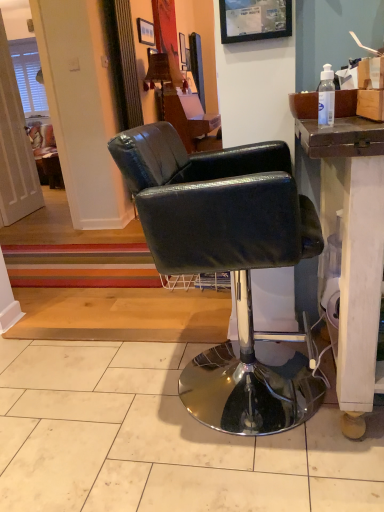
Identify the location of free point below black leather chair at center (from a real-world perspective). (201, 382).